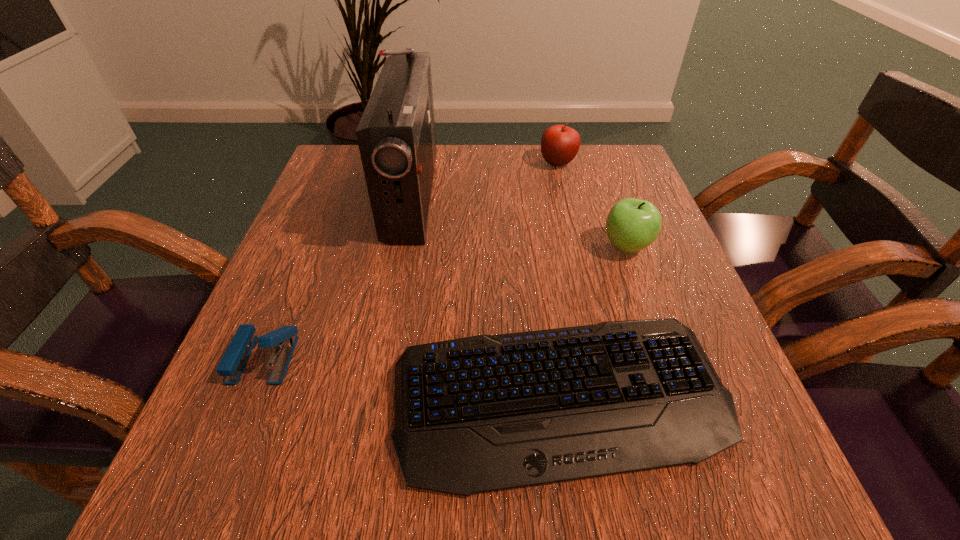
What are the coordinates of `free location located on the back of the shortest object` in the screenshot? It's located at (539, 247).

What are the coordinates of `radio receiver at the far edge` in the screenshot? It's located at (396, 136).

Locate an element on the screen. This screenshot has height=540, width=960. apple that is at the far edge is located at coordinates (560, 144).

You are a GUI agent. You are given a task and a screenshot of the screen. Output one action in this format:
    pyautogui.click(x=<x>, y=<y>)
    Task: Click on the object present at the near edge
    
    Given the screenshot: What is the action you would take?
    pyautogui.click(x=483, y=413)

At what (x,y) coordinates should I click in order to perform the action: click on object that is at the left edge. Please return your answer as a coordinate pair (x, y). The height and width of the screenshot is (540, 960). Looking at the image, I should click on [x=235, y=358].

The image size is (960, 540). What are the coordinates of `computer keyboard that is at the right edge` in the screenshot? It's located at (483, 413).

Identify the location of object at the far right corner. The width and height of the screenshot is (960, 540). (560, 144).

I want to click on object located in the near right corner section of the desktop, so click(x=483, y=413).

The width and height of the screenshot is (960, 540). I want to click on blank space at the far edge of the desktop, so click(x=568, y=191).

In the image, there is a desktop. At what (x,y) coordinates should I click in order to perform the action: click on vacant space at the near edge. Please return your answer as a coordinate pair (x, y). The height and width of the screenshot is (540, 960). Looking at the image, I should click on (361, 498).